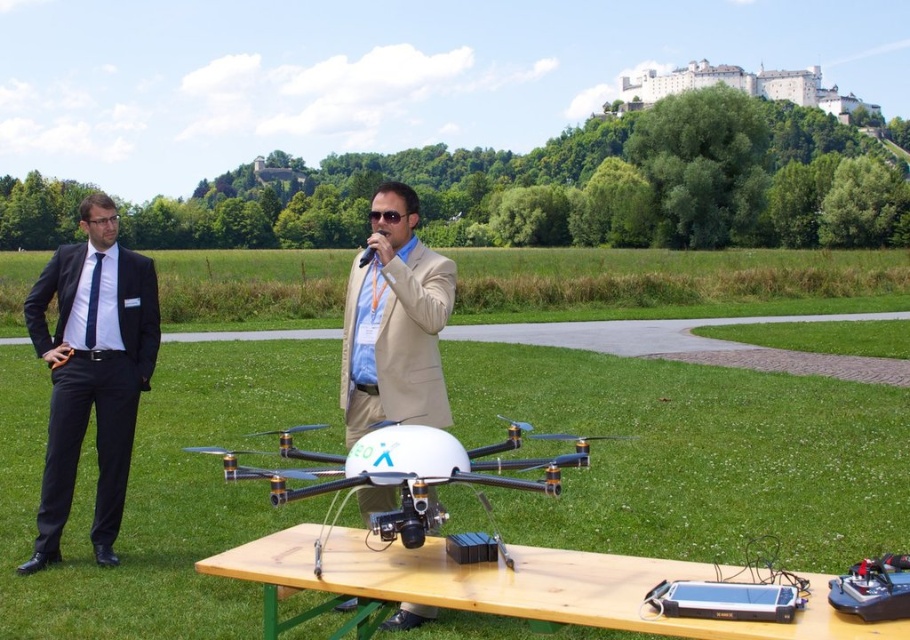
You are attending a tech fair and notice two items on a table to your left. The items are the black suit at left and the blue silk tie at left. Which one is positioned further to the left?

The black suit at left is positioned further to the left because it is to the left of the blue silk tie at left.

You are organizing an outdoor event and need to place a 1.2 meter wide banner between the wooden table at center and the beige fabric suit at center. Can the banner fit between them based on their widths?

The wooden table at center might be wider than beige fabric suit at center, so the banner might not fit if the total width of both objects exceeds 1.2 meters. However, without exact measurements, it is uncertain.

You are organizing an outdoor event and need to ensure that the black suit at left and the blue silk tie at left can fit side by side on a narrow table. Based on their widths, will they both fit without overlapping?

The black suit at left might be wider than blue silk tie at left, so there is a possibility they might overlap if placed side by side on a narrow table.